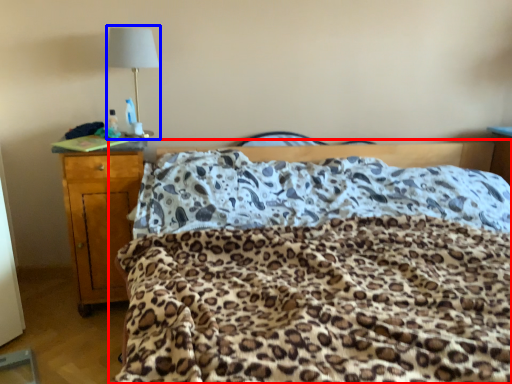
Question: Which of the following is the closest to the observer, bed (highlighted by a red box) or lamp (highlighted by a blue box)?

Choices:
 (A) bed
 (B) lamp

Answer: (A)